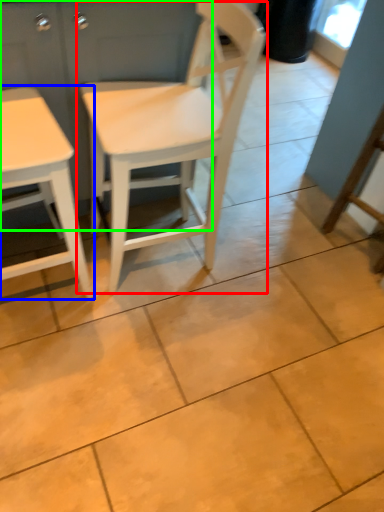
Question: Which object is the farthest from chair (highlighted by a red box)? Choose among these: table (highlighted by a blue box) or dresser (highlighted by a green box).

Choices:
 (A) table
 (B) dresser

Answer: (A)